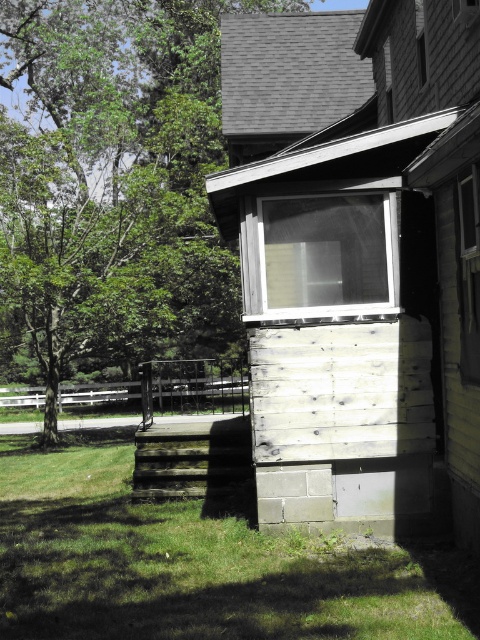
Can you confirm if green leafy tree at upper left is positioned to the right of green grass at lower left?

In fact, green leafy tree at upper left is to the left of green grass at lower left.

Describe the element at coordinates (112, 180) in the screenshot. The height and width of the screenshot is (640, 480). I see `green leafy tree at upper left` at that location.

This screenshot has height=640, width=480. Find the location of `green leafy tree at upper left`. green leafy tree at upper left is located at coordinates (112, 180).

This screenshot has width=480, height=640. I want to click on green leafy tree at upper left, so click(112, 180).